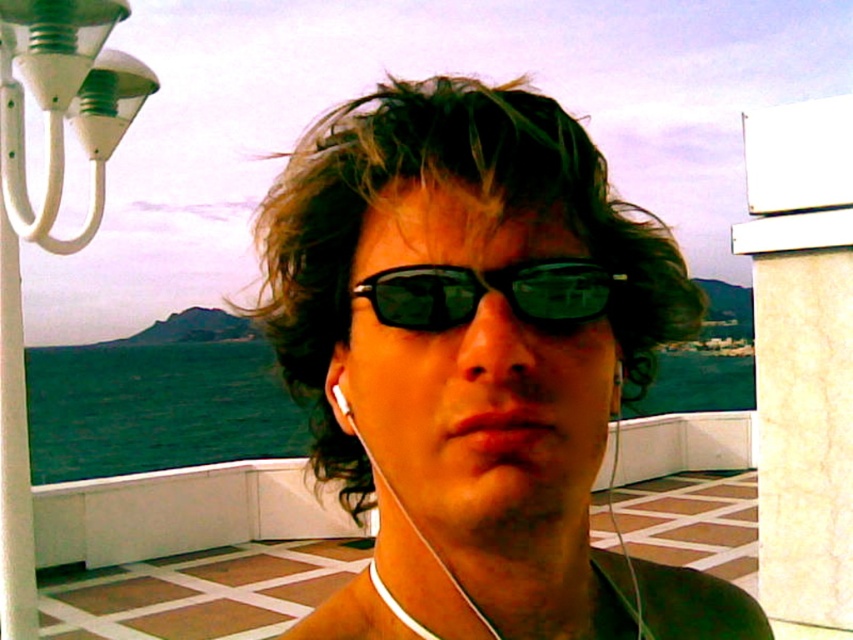
Question: Which object is the farthest from the green reflective plastic goggles at center?

Choices:
 (A) dark curly hair at center
 (B) white earphone at center

Answer: (A)

Question: Which of the following is the closest to the observer?

Choices:
 (A) (552, 268)
 (B) (332, 388)

Answer: (A)

Question: Can you confirm if dark curly hair at center is positioned to the left of green reflective plastic goggles at center?

Choices:
 (A) no
 (B) yes

Answer: (B)

Question: Is dark curly hair at center above white earphone at center?

Choices:
 (A) yes
 (B) no

Answer: (B)

Question: Does green reflective plastic goggles at center have a lesser width compared to white earphone at center?

Choices:
 (A) yes
 (B) no

Answer: (B)

Question: Estimate the real-world distances between objects in this image. Which object is closer to the dark curly hair at center?

Choices:
 (A) green reflective plastic goggles at center
 (B) white earphone at center

Answer: (A)